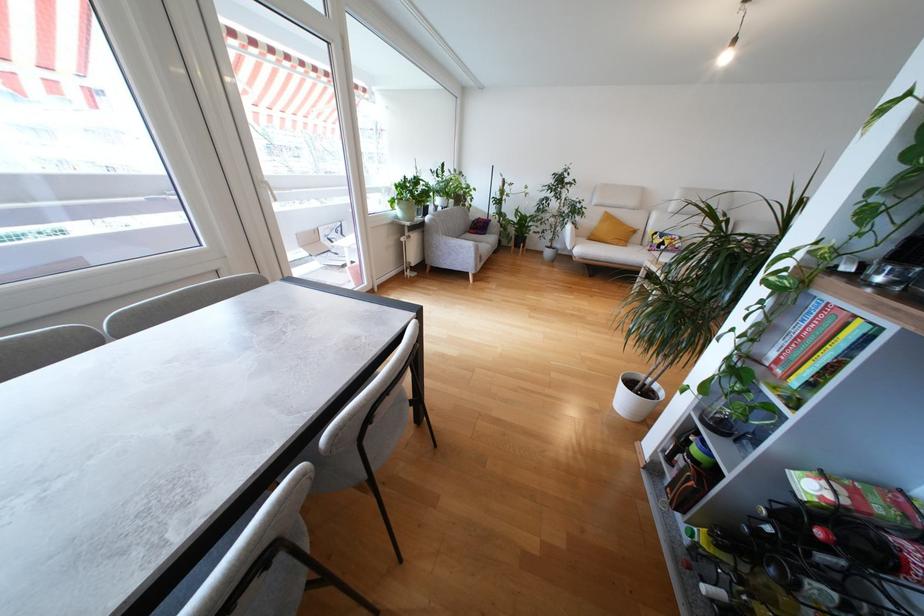
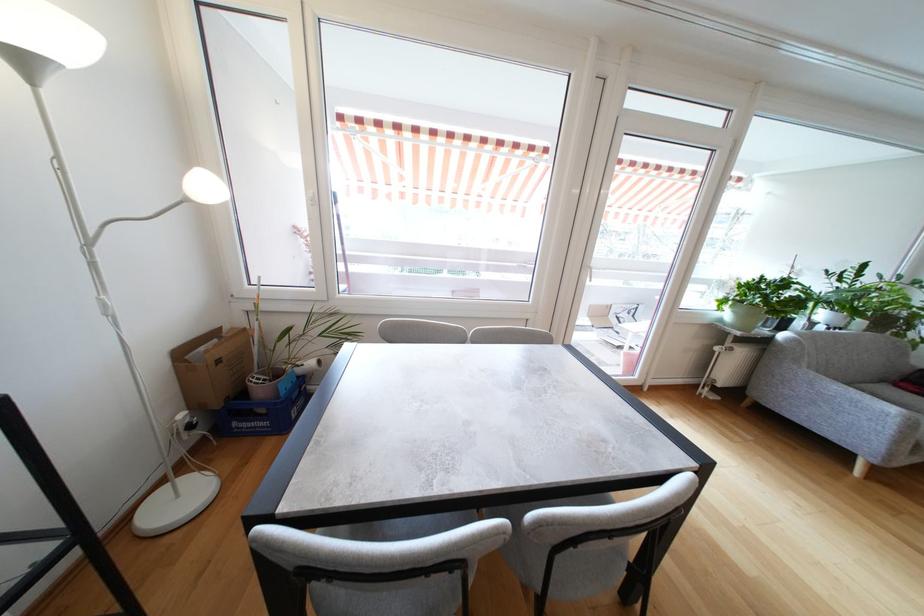
Locate, in the second image, the point that corresponds to pixel 428 233 in the first image.

(768, 352)